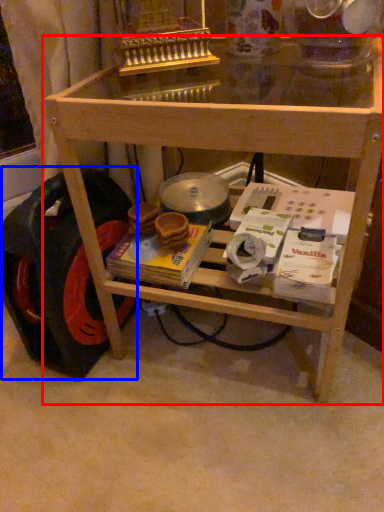
Question: Among these objects, which one is nearest to the camera, table (highlighted by a red box) or wheel (highlighted by a blue box)?

Choices:
 (A) table
 (B) wheel

Answer: (A)